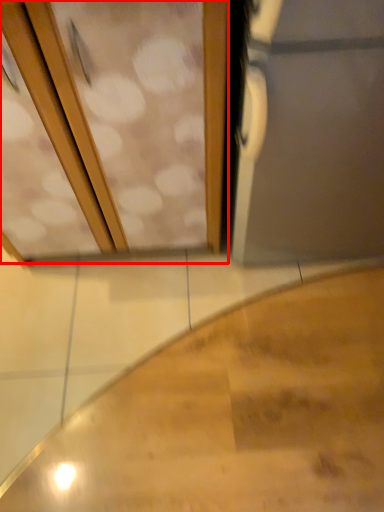
Question: From the image, what is the correct spatial relationship of screen door (annotated by the red box) in relation to stairs?

Choices:
 (A) left
 (B) right

Answer: (A)